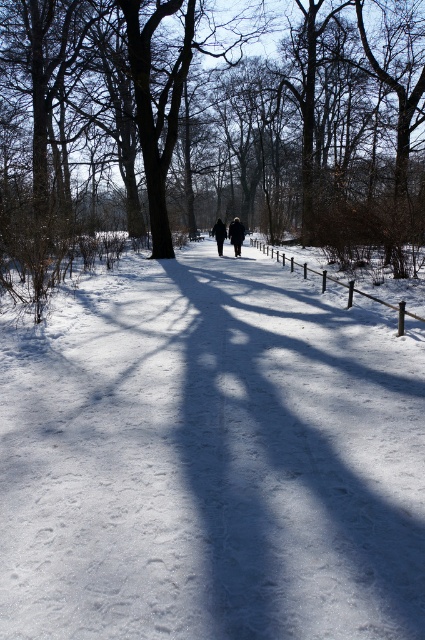
Consider the image. You are standing at the point marked by the coordinate point (209, 460) in the winter scene. What is the color of the ground beneath your feet?

The white snow at center is represented by point (209, 460), so the ground beneath your feet is white.

You are an observer standing at the edge of the path in the winter scene. You see the white snow at center and the black fabric at center. Which object is taller from your viewpoint?

The black fabric at center is taller than the white snow at center.

You are a photographer planning to capture the winter scene with both the dark blue coat at center and the black fabric at center in the frame. Which object should you position closer to the camera to ensure it appears larger in the photo?

To make the object appear larger in the photo, position the dark blue coat at center closer to the camera since it might be wider than the black fabric at center.